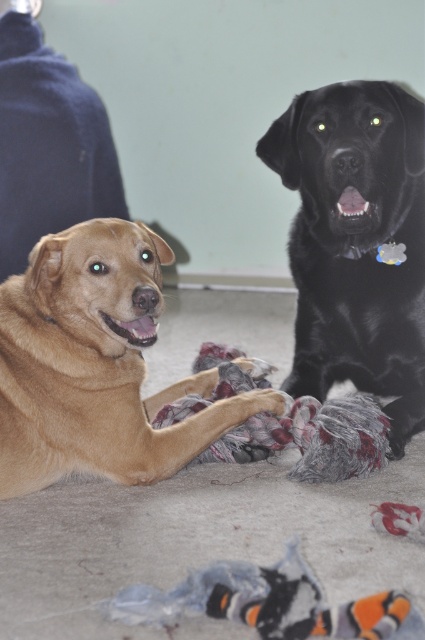
Is the position of golden brown fur at center more distant than that of black glossy dog at upper right?

That is False.

I want to click on golden brown fur at center, so click(96, 364).

You are a GUI agent. You are given a task and a screenshot of the screen. Output one action in this format:
    pyautogui.click(x=<x>, y=<y>)
    Task: Click on the golden brown fur at center
    
    Given the screenshot: What is the action you would take?
    pyautogui.click(x=96, y=364)

Find the location of a particular element. golden brown fur at center is located at coordinates (96, 364).